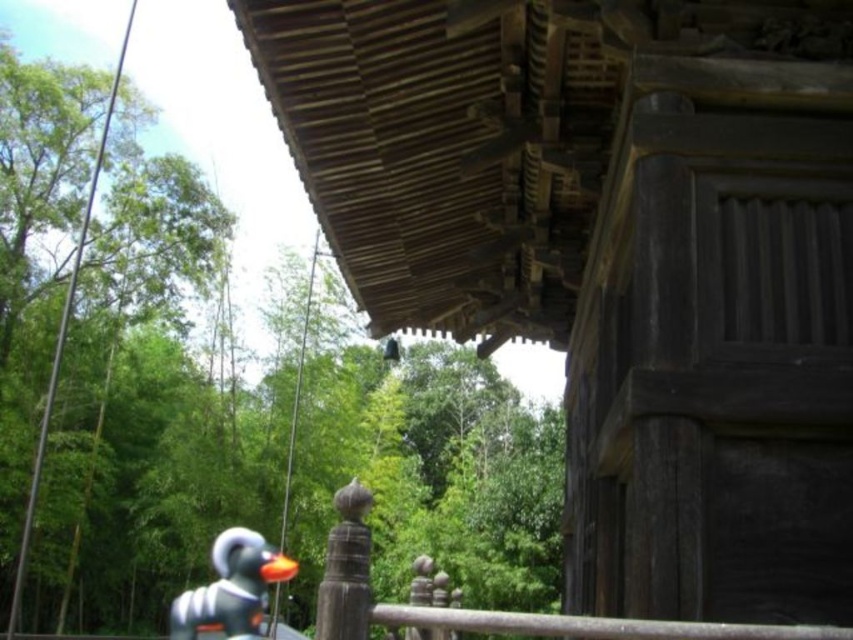
You are standing in front of the traditional wooden structure and need to locate a specific point marked as point [614,257]. According to the scene description, where exactly would this point be located?

The point [614,257] is located on the dark brown wood at upper right.

You are a visitor at the temple and want to take a photo of the white matte rubber duck at lower left without any obstructions. Is the dark brown wood at upper right blocking your view of the duck?

The white matte rubber duck at lower left is behind the dark brown wood at upper right, so the dark brown wood at upper right is blocking the view of the duck. To take an unobstructed photo, you would need to move to a position where the dark brown wood at upper right is no longer in front of the duck.

You are standing 10 feet away from the wooden structure in the image. A point labeled as point (833, 65) is located on the structure. Can you reach that point without moving closer than 10 feet?

The distance of point (833, 65) from viewer is 15.52 feet, so you cannot reach it without moving closer than 10 feet.